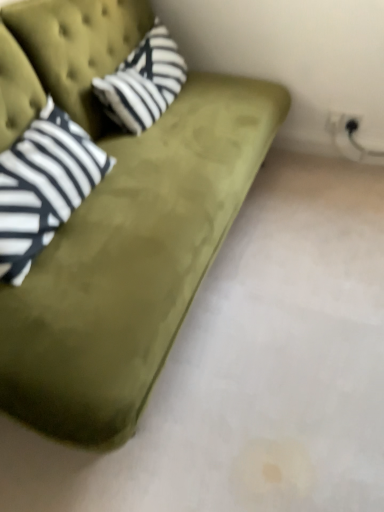
Question: Does olive green velvet couch at upper left come in front of striped cotton pillow at upper left?

Choices:
 (A) no
 (B) yes

Answer: (B)

Question: Does olive green velvet couch at upper left contain striped cotton pillow at upper left?

Choices:
 (A) no
 (B) yes

Answer: (B)

Question: From the image's perspective, is olive green velvet couch at upper left located beneath striped cotton pillow at upper left?

Choices:
 (A) no
 (B) yes

Answer: (B)

Question: Would you consider olive green velvet couch at upper left to be distant from striped cotton pillow at upper left?

Choices:
 (A) no
 (B) yes

Answer: (A)

Question: Is olive green velvet couch at upper left at the right side of striped cotton pillow at upper left?

Choices:
 (A) no
 (B) yes

Answer: (A)

Question: Is olive green velvet couch at upper left situated inside striped fabric pillow at left or outside?

Choices:
 (A) outside
 (B) inside

Answer: (A)

Question: Is olive green velvet couch at upper left to the left or to the right of striped fabric pillow at left in the image?

Choices:
 (A) left
 (B) right

Answer: (B)

Question: Is olive green velvet couch at upper left in front of or behind striped fabric pillow at left in the image?

Choices:
 (A) behind
 (B) front

Answer: (B)

Question: In terms of width, does olive green velvet couch at upper left look wider or thinner when compared to striped fabric pillow at left?

Choices:
 (A) thin
 (B) wide

Answer: (B)

Question: From their relative heights in the image, would you say striped fabric pillow at left is taller or shorter than olive green velvet couch at upper left?

Choices:
 (A) short
 (B) tall

Answer: (A)

Question: Considering their positions, is striped fabric pillow at left located in front of or behind olive green velvet couch at upper left?

Choices:
 (A) behind
 (B) front

Answer: (A)

Question: From a real-world perspective, is striped fabric pillow at left physically located above or below olive green velvet couch at upper left?

Choices:
 (A) below
 (B) above

Answer: (B)

Question: Is point (59, 172) closer or farther from the camera than point (99, 44)?

Choices:
 (A) closer
 (B) farther

Answer: (A)

Question: Based on their sizes in the image, would you say olive green velvet couch at upper left is bigger or smaller than striped cotton pillow at upper left?

Choices:
 (A) small
 (B) big

Answer: (B)

Question: Which is correct: olive green velvet couch at upper left is inside striped cotton pillow at upper left, or outside of it?

Choices:
 (A) outside
 (B) inside

Answer: (A)